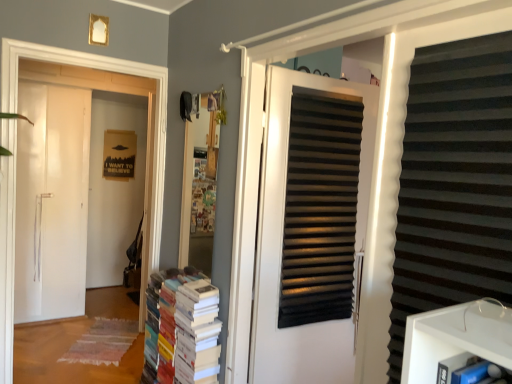
Question: In terms of size, does white paper book at center appear bigger or smaller than white matte door at left, placed as the second door when sorted from right to left?

Choices:
 (A) small
 (B) big

Answer: (A)

Question: From their relative heights in the image, would you say white paper book at center is taller or shorter than white matte door at left, placed as the second door when sorted from right to left?

Choices:
 (A) short
 (B) tall

Answer: (A)

Question: Based on their relative distances, which object is nearer to the white matte door at left, positioned as the first door in left-to-right order?

Choices:
 (A) black matte door at center, the first door viewed from the right
 (B) white paper book at center
 (C) black matte shutter at right

Answer: (B)

Question: Which is nearer to the black matte door at center, the first door when ordered from front to back?

Choices:
 (A) white paper book at center
 (B) black matte shutter at right
 (C) white matte door at left, which ranks as the 1th door in back-to-front order

Answer: (A)